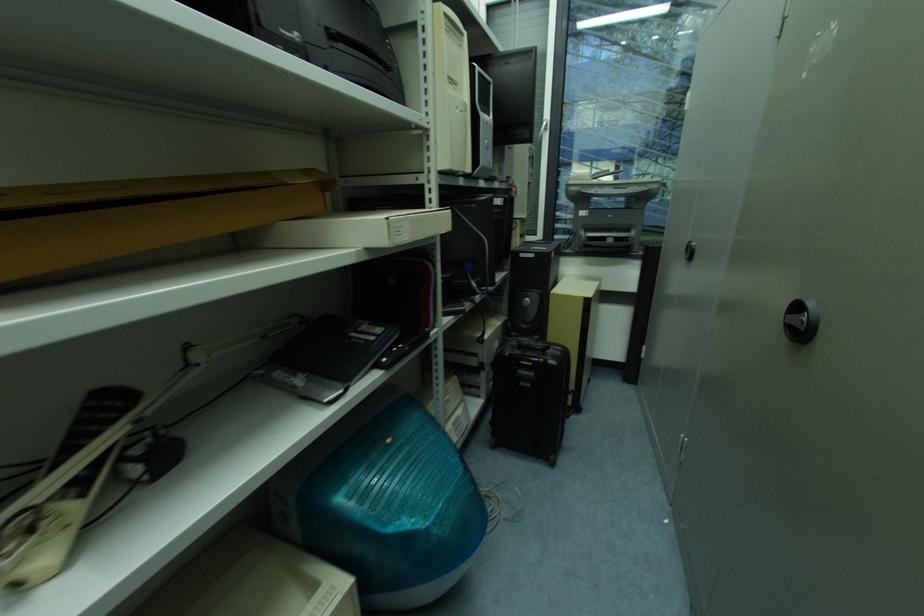
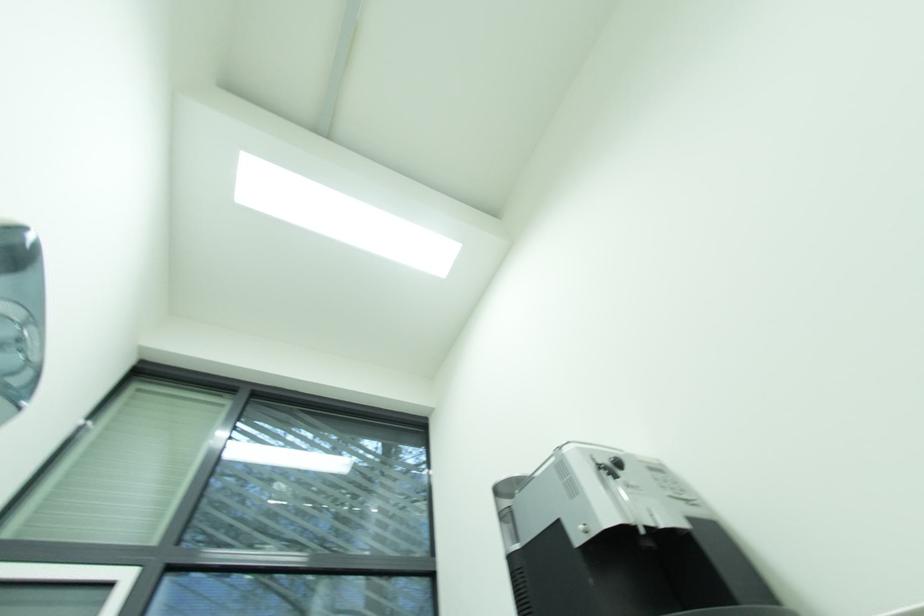
How did the camera likely rotate?

The rotation direction of the camera is right-up.